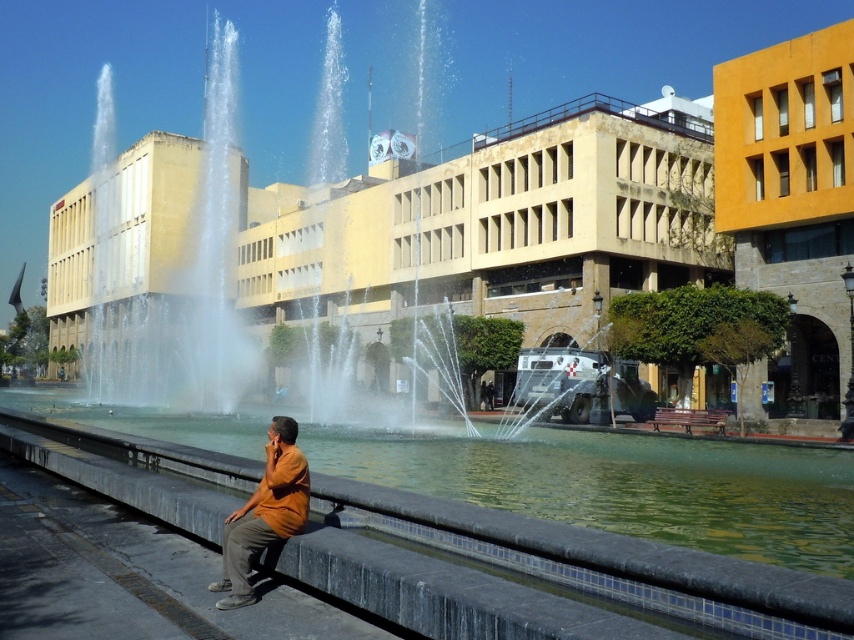
Which of these two, smooth concrete ledge at lower center or orange cotton shirt at lower center, stands taller?

orange cotton shirt at lower center

Does smooth concrete ledge at lower center have a smaller size compared to orange cotton shirt at lower center?

No, smooth concrete ledge at lower center is not smaller than orange cotton shirt at lower center.

Identify the location of smooth concrete ledge at lower center. (537, 572).